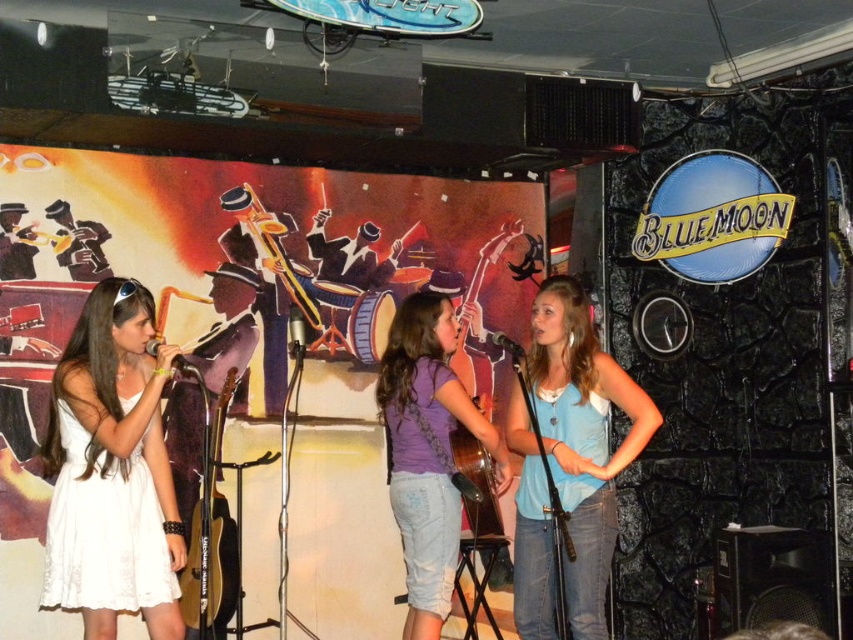
You are a photographer at the Blue Moon venue and need to capture a closeup shot of the blue cotton tank top at center and the gold metallic guitar at center. Since your camera has a limited focus range, which item should you prioritize to ensure it is in focus first?

The blue cotton tank top at center is smaller than the gold metallic guitar at center, so you should prioritize focusing on the gold metallic guitar at center first because larger objects require more precise focus to capture details effectively.

You are a photographer positioned at the center of the room. You want to capture a photo of the purple denim shorts at center. What is the exact coordinate where you should aim your camera?

The purple denim shorts at center is located at point (428, 452), so you should aim your camera at those coordinates to capture it.

You are a photographer at the Blue Moon venue and need to capture a photo of the performers. The stage has limited space, and you want to ensure both the white lace dress at left and the blue cotton tank top at center are visible in the frame. Based on their positions, which performer should you focus on first to include both in the shot?

The white lace dress at left is to the left of the blue cotton tank top at center. To include both in the frame, focus on the white lace dress at left first as it is positioned further left, ensuring the blue cotton tank top at center remains within the shot.